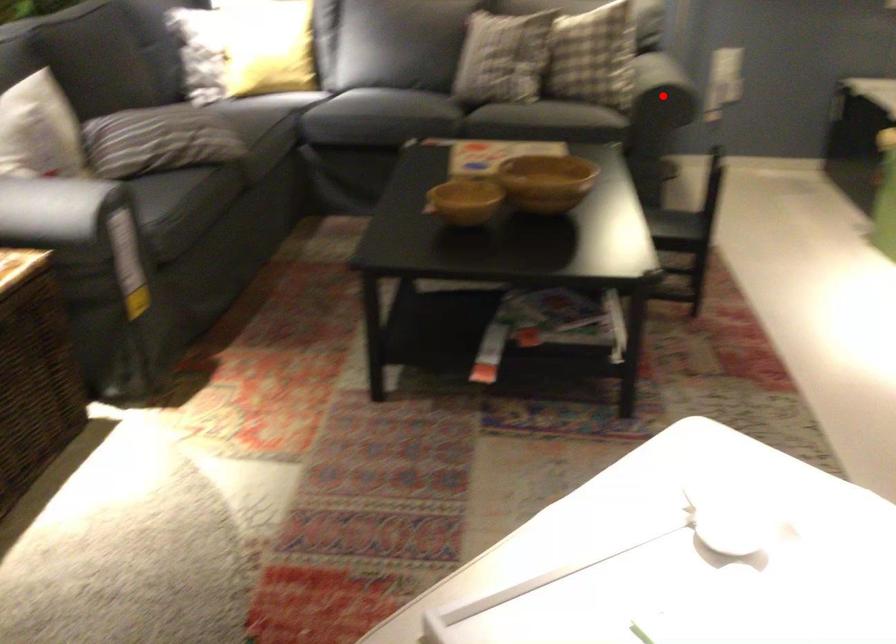
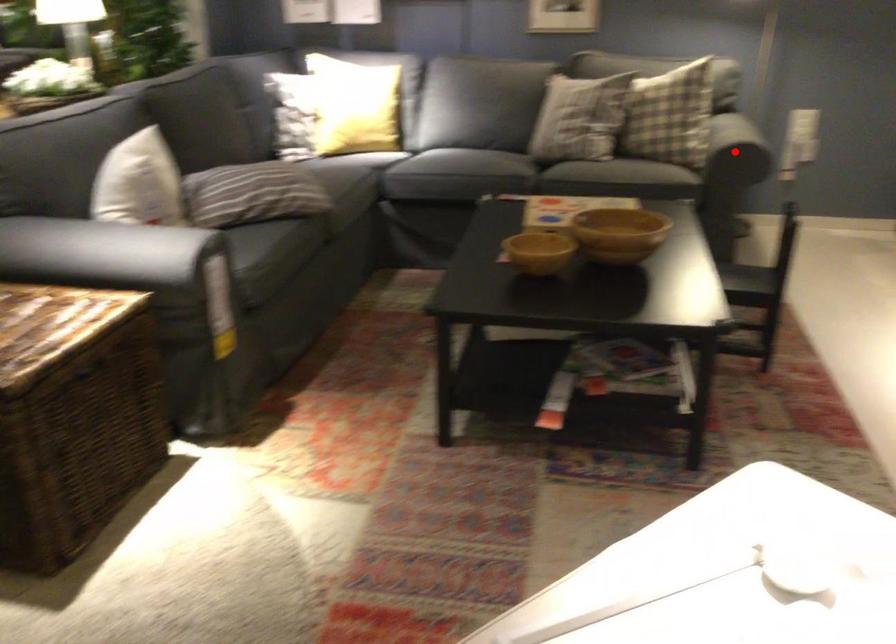
I am providing you with two images of the same scene from different viewpoints. A red point is marked on the first image and another point is marked on the second image. Is the marked point in image1 the same physical position as the marked point in image2?

Yes